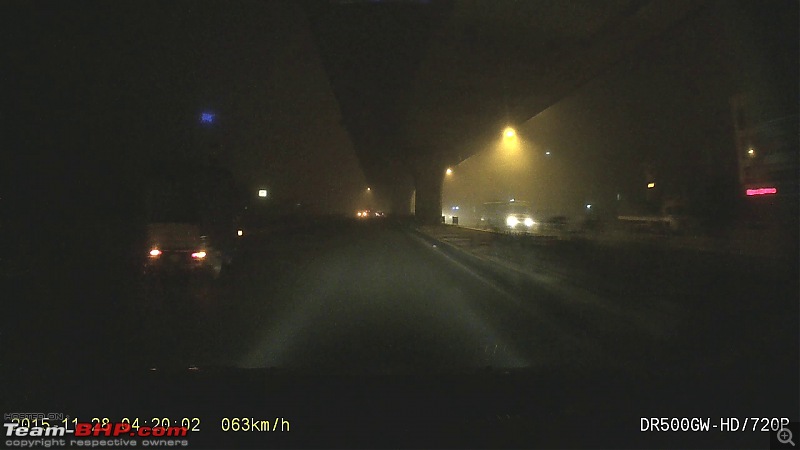
Locate an element on the screen. The width and height of the screenshot is (800, 450). pink light is located at coordinates (750, 196), (762, 195).